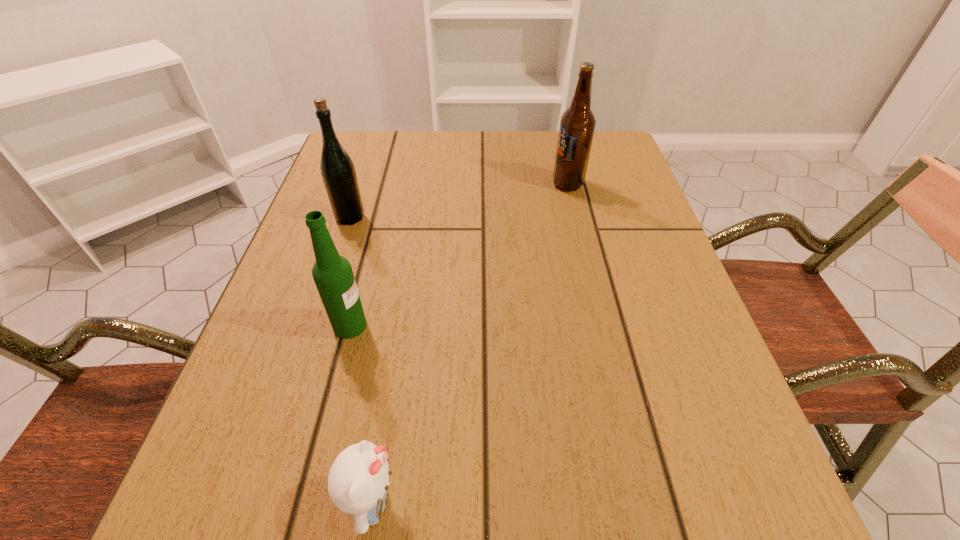
Where is `free point located 0.360m on the label of the second beer bottle from right to left`? free point located 0.360m on the label of the second beer bottle from right to left is located at coordinates (580, 326).

Locate an element on the screen. object at the far edge is located at coordinates (577, 124).

Find the location of a particular element. object situated at the right edge is located at coordinates (577, 124).

At what (x,y) coordinates should I click in order to perform the action: click on object at the far right corner. Please return your answer as a coordinate pair (x, y). This screenshot has height=540, width=960. Looking at the image, I should click on (577, 124).

Locate an element on the screen. This screenshot has height=540, width=960. vacant point at the far edge is located at coordinates (494, 153).

This screenshot has width=960, height=540. In the image, there is a desktop. What are the coordinates of `vacant space at the left edge` in the screenshot? It's located at 352,229.

The width and height of the screenshot is (960, 540). What are the coordinates of `vacant space at the right edge of the desktop` in the screenshot? It's located at (587, 213).

Locate an element on the screen. This screenshot has height=540, width=960. free space at the near left corner is located at coordinates (233, 517).

I want to click on vacant space at the far right corner of the desktop, so click(x=619, y=180).

Locate which object ranks in proximity to the second beer bottle from right to left. Please provide its 2D coordinates. Your answer should be formatted as a tuple, i.e. [(x, y)], where the tuple contains the x and y coordinates of a point satisfying the conditions above.

[(358, 480)]